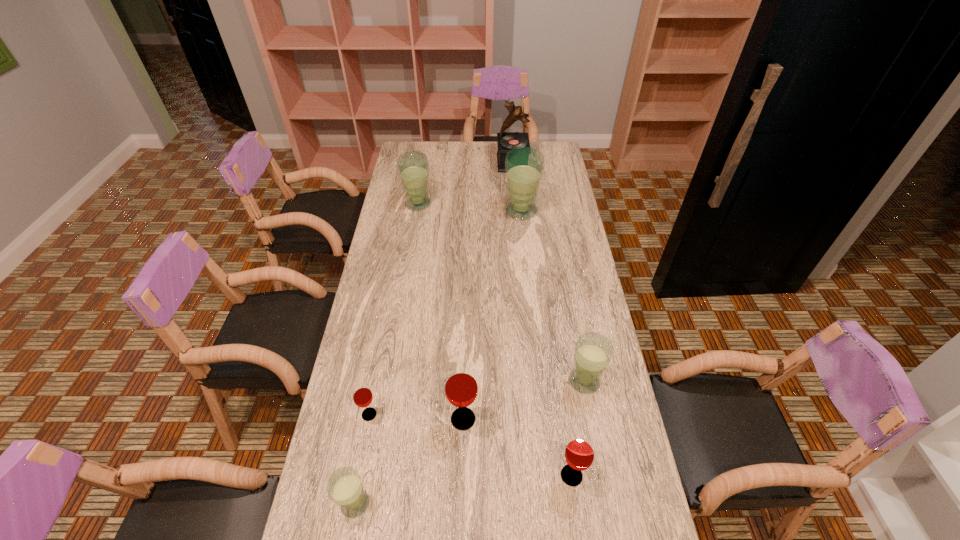
Locate an element on the screen. free space between the tallest glass and the smallest red glass is located at coordinates (445, 313).

Locate an element on the screen. The image size is (960, 540). object that is the third closest to the phonograph_record is located at coordinates (593, 351).

Image resolution: width=960 pixels, height=540 pixels. I want to click on object that stands as the fifth closest to the smallest red glass, so click(413, 167).

Find the location of a particular element. glass that is the second closest to the smallest red glass is located at coordinates (461, 387).

Choose which glass is the nearest neighbor to the leftmost red glass. Please provide its 2D coordinates. Your answer should be formatted as a tuple, i.e. [(x, y)], where the tuple contains the x and y coordinates of a point satisfying the conditions above.

[(345, 487)]

You are a GUI agent. You are given a task and a screenshot of the screen. Output one action in this format:
    pyautogui.click(x=<x>, y=<y>)
    Task: Click on the blue glass that stands as the closest to the second smallest blue glass
    The width and height of the screenshot is (960, 540).
    Given the screenshot: What is the action you would take?
    pyautogui.click(x=345, y=487)

You are a GUI agent. You are given a task and a screenshot of the screen. Output one action in this format:
    pyautogui.click(x=<x>, y=<y>)
    Task: Click on the blue glass that is the closest to the third smallest blue glass
    This screenshot has height=540, width=960.
    Given the screenshot: What is the action you would take?
    click(x=524, y=166)

Locate an element on the screen. This screenshot has width=960, height=540. the closest red glass to the fourth glass from left to right is located at coordinates (362, 395).

Identify which red glass is the third closest to the third blue glass from left to right. Please provide its 2D coordinates. Your answer should be formatted as a tuple, i.e. [(x, y)], where the tuple contains the x and y coordinates of a point satisfying the conditions above.

[(579, 454)]

Image resolution: width=960 pixels, height=540 pixels. What are the coordinates of `free space that satisfies the following two spatial constraints: 1. at the horn opening of the phonograph_record; 2. on the front side of the smallest blue glass` in the screenshot? It's located at (544, 503).